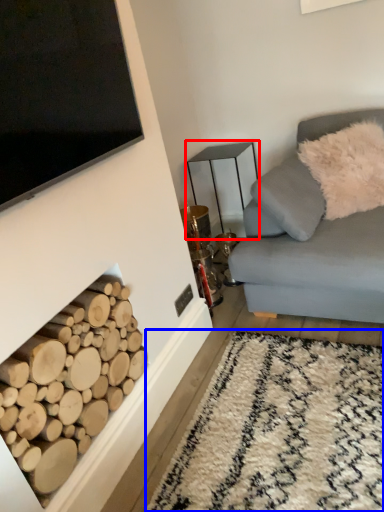
Question: Which of the following is the closest to the observer, table (highlighted by a red box) or plain (highlighted by a blue box)?

Choices:
 (A) table
 (B) plain

Answer: (B)